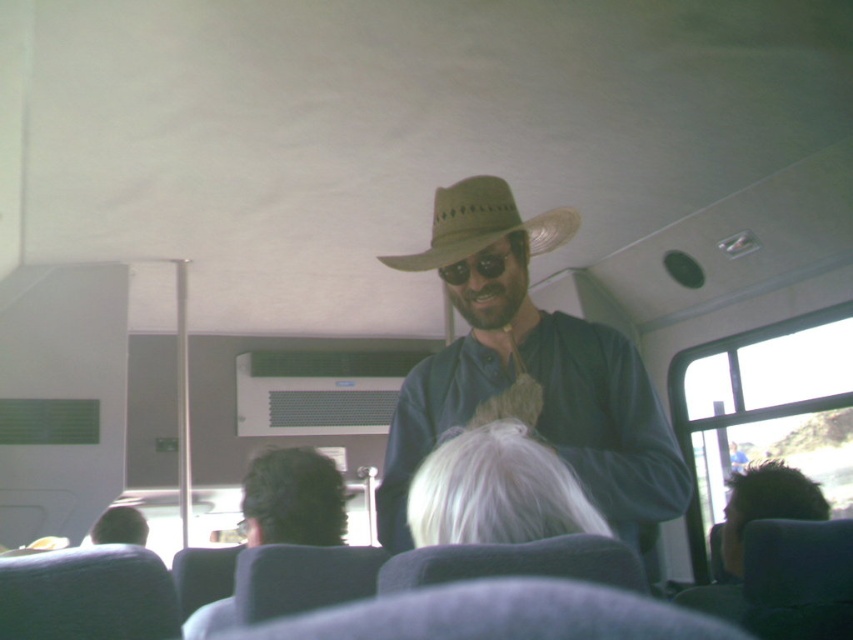
Consider the image. You are a passenger sitting in a bus and you see a man standing in front of you. There is a point at coordinate [531,376] on his matte straw hat at center. If you want to point at the hat, where should you look?

You should look at the point at coordinate [531,376] on the matte straw hat at center to point at the hat.

You are a passenger on a bus and see two people with dark brown hair at center and dark brown hair at lower left. Which one is sitting to the right of the other?

The dark brown hair at center is positioned on the right side of dark brown hair at lower left, so the person with dark brown hair at center is sitting to the right of the person with dark brown hair at lower left.